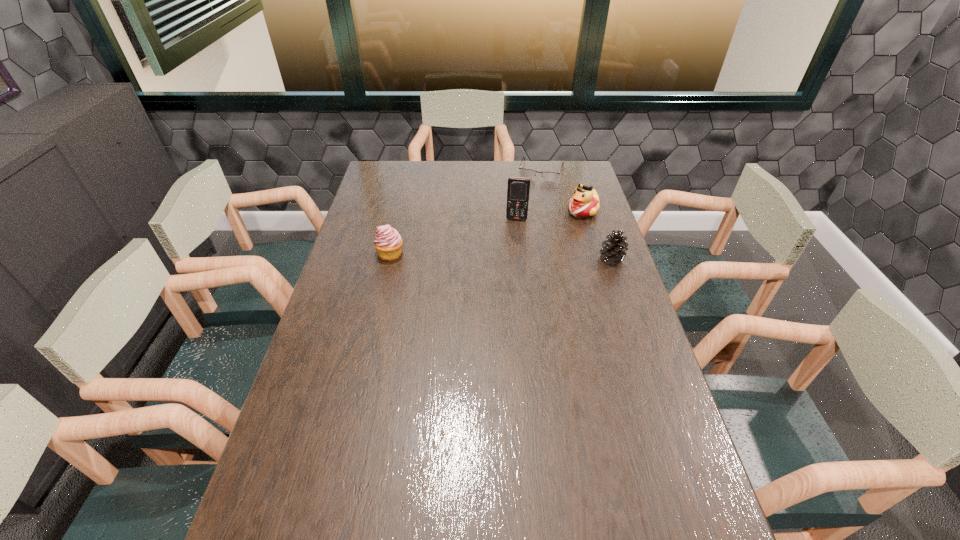
At what (x,y) coordinates should I click in order to perform the action: click on free space on the desktop that is between the leftmost object and the pinecone and is positioned on the face of the duck. Please return your answer as a coordinate pair (x, y). The image size is (960, 540). Looking at the image, I should click on (519, 256).

You are a GUI agent. You are given a task and a screenshot of the screen. Output one action in this format:
    pyautogui.click(x=<x>, y=<y>)
    Task: Click on the vacant space on the desktop that is between the cupcake and the pinecone and is positioned on the front-facing side of the shortest object
    Image resolution: width=960 pixels, height=540 pixels.
    Given the screenshot: What is the action you would take?
    pyautogui.click(x=513, y=256)

Find the location of `vacant spot on the desktop that is between the cupcake and the pinecone and is positioned on the screen of the tallest object`. vacant spot on the desktop that is between the cupcake and the pinecone and is positioned on the screen of the tallest object is located at coordinates (512, 256).